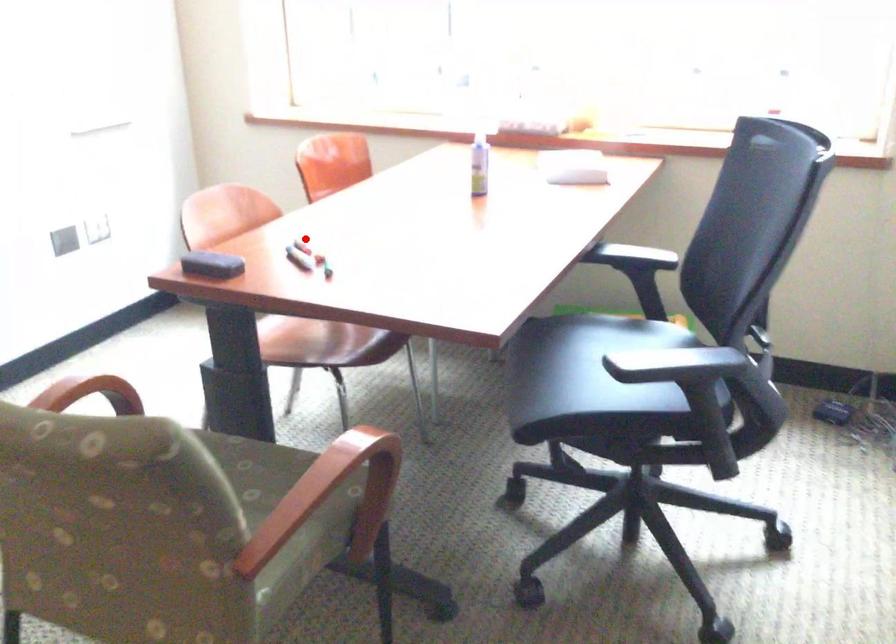
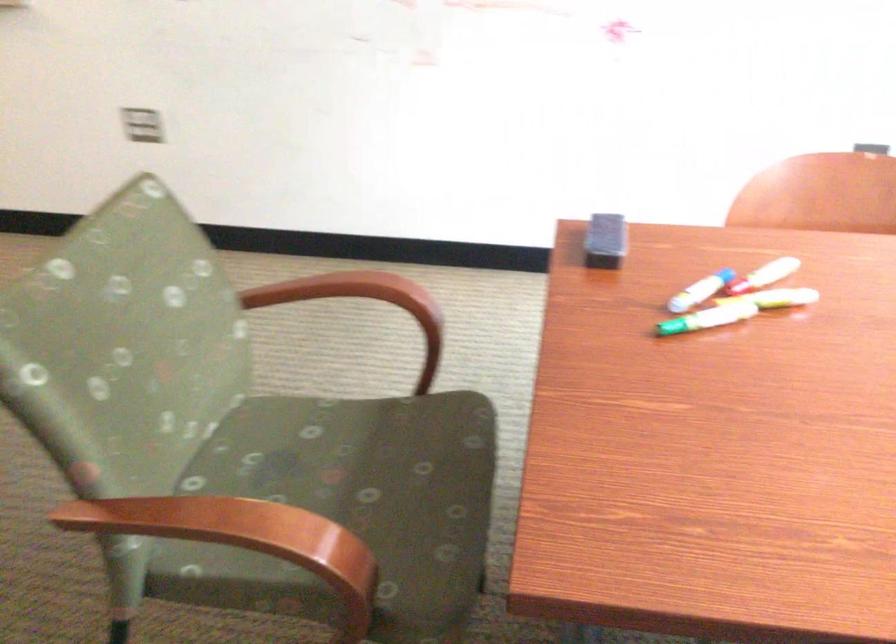
Question: I am providing you with two images of the same scene from different viewpoints. In image1, a red point is highlighted. Considering the same 3D point in image2, which of the following is correct?

Choices:
 (A) It is closer
 (B) It is farther

Answer: (A)